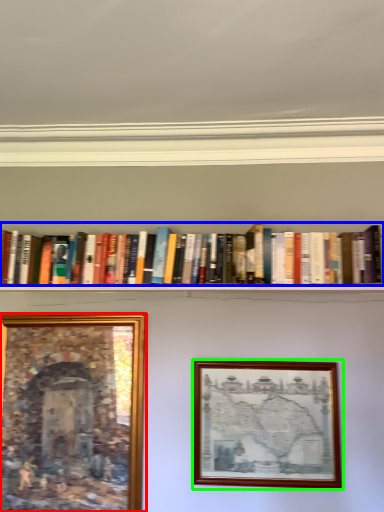
Question: Based on their relative distances, which object is nearer to picture frame (highlighted by a red box)? Choose from book (highlighted by a blue box) and picture frame (highlighted by a green box).

Choices:
 (A) book
 (B) picture frame

Answer: (B)